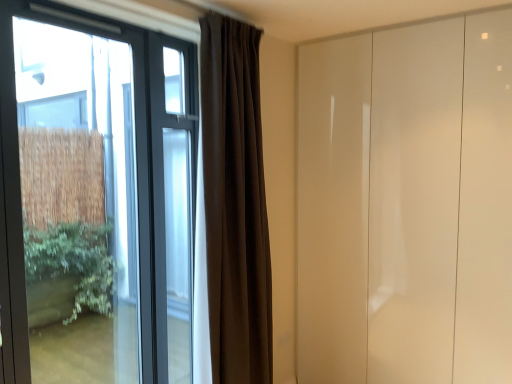
Question: Is clear glass window at left at the right side of dark matte curtain at center?

Choices:
 (A) yes
 (B) no

Answer: (B)

Question: Can you confirm if clear glass window at left is positioned to the left of dark matte curtain at center?

Choices:
 (A) no
 (B) yes

Answer: (B)

Question: From a real-world perspective, does clear glass window at left sit lower than dark matte curtain at center?

Choices:
 (A) no
 (B) yes

Answer: (B)

Question: Considering the relative sizes of clear glass window at left and dark matte curtain at center in the image provided, is clear glass window at left thinner than dark matte curtain at center?

Choices:
 (A) no
 (B) yes

Answer: (B)

Question: Is clear glass window at left wider than dark matte curtain at center?

Choices:
 (A) no
 (B) yes

Answer: (A)

Question: From the image's perspective, is clear glass window at left located above dark matte curtain at center?

Choices:
 (A) no
 (B) yes

Answer: (A)

Question: Is dark matte curtain at center at the right side of glossy white door at right?

Choices:
 (A) yes
 (B) no

Answer: (B)

Question: Is dark matte curtain at center in front of glossy white door at right?

Choices:
 (A) yes
 (B) no

Answer: (A)

Question: Does dark matte curtain at center have a lesser width compared to glossy white door at right?

Choices:
 (A) no
 (B) yes

Answer: (B)

Question: Does dark matte curtain at center touch glossy white door at right?

Choices:
 (A) no
 (B) yes

Answer: (A)

Question: Considering the relative sizes of dark matte curtain at center and glossy white door at right in the image provided, is dark matte curtain at center shorter than glossy white door at right?

Choices:
 (A) yes
 (B) no

Answer: (A)

Question: Is dark matte curtain at center facing towards glossy white door at right?

Choices:
 (A) no
 (B) yes

Answer: (A)

Question: Can you confirm if glossy white door at right is thinner than clear glass window at left?

Choices:
 (A) yes
 (B) no

Answer: (B)